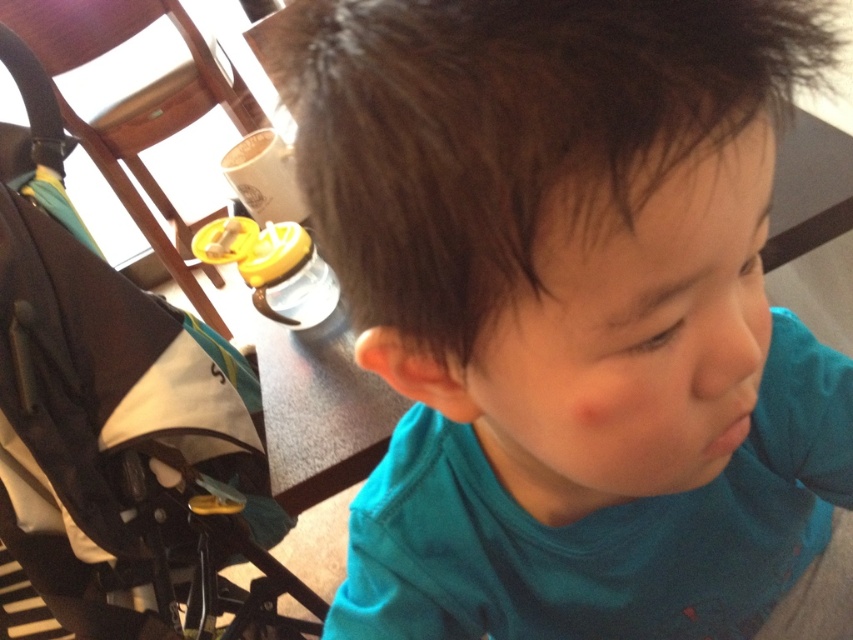
You are taking a photo of the child and notice two points in the image. One is at coordinates point (410, 248) and the other at point (138, 342). Which point is closer to the camera?

Point (410, 248) is closer to the camera than point (138, 342).

You are taking a photo of the child wearing the teal matte shirt at center and the black fabric stroller at left. Which object will appear larger in the photo?

The teal matte shirt at center will appear larger in the photo because it is closer to the viewer than the black fabric stroller at left.